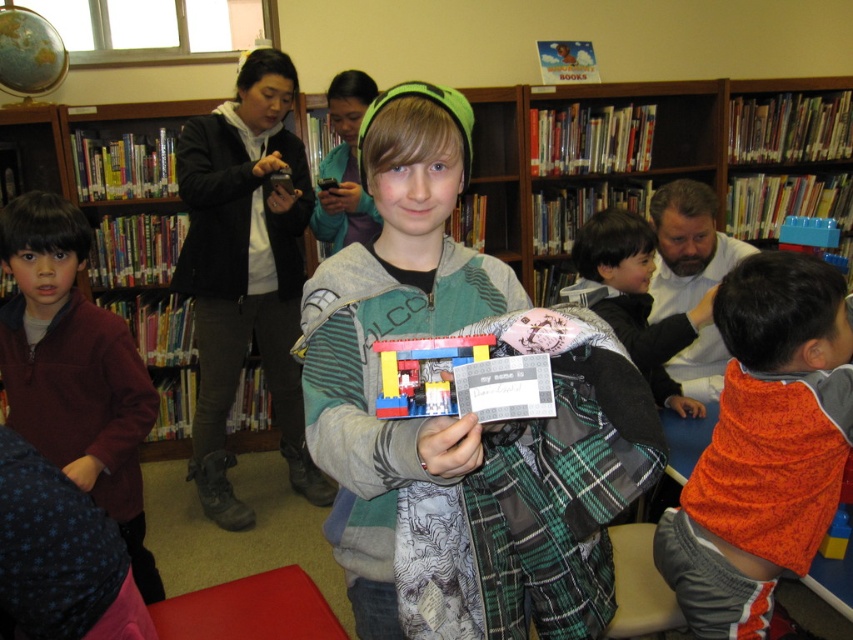
Between plaid fabric jacket at center and orange fleece sweater at center, which one appears on the left side from the viewer's perspective?

From the viewer's perspective, plaid fabric jacket at center appears more on the left side.

Can you confirm if plaid fabric jacket at center is wider than orange fleece sweater at center?

Indeed, plaid fabric jacket at center has a greater width compared to orange fleece sweater at center.

Locate an element on the screen. The image size is (853, 640). plaid fabric jacket at center is located at coordinates (431, 417).

Does point (749, 532) lie behind point (415, 342)?

Yes, point (749, 532) is farther from viewer.

Find the location of `orange knitted sweater at lower right`. orange knitted sweater at lower right is located at coordinates (764, 445).

Is point (485, 241) behind point (717, 525)?

Yes.

This screenshot has height=640, width=853. Find the location of `wooden bookcase at upper center`. wooden bookcase at upper center is located at coordinates (654, 163).